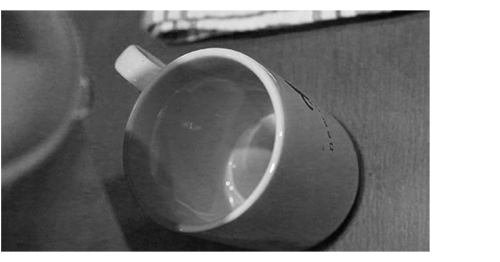
What are the coordinates of `table` in the screenshot? It's located at click(379, 205).